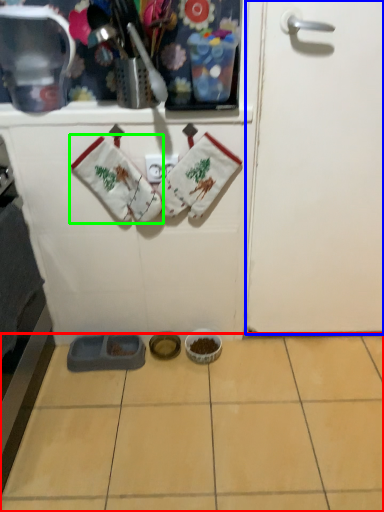
Question: Which is nearer to the ceramic tile (highlighted by a red box)? door (highlighted by a blue box) or baby clothe (highlighted by a green box).

Choices:
 (A) door
 (B) baby clothe

Answer: (A)